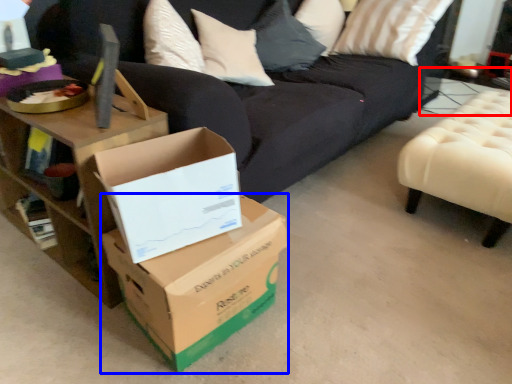
Question: Among these objects, which one is farthest to the camera, side table (highlighted by a red box) or box (highlighted by a blue box)?

Choices:
 (A) side table
 (B) box

Answer: (A)